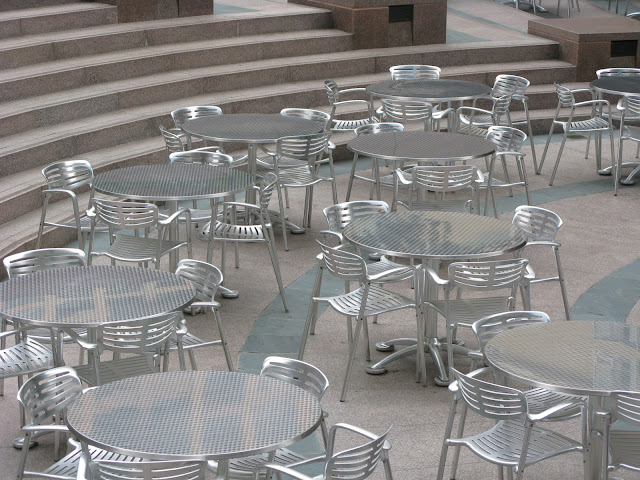
You are a GUI agent. You are given a task and a screenshot of the screen. Output one action in this format:
    pyautogui.click(x=<x>, y=<y>)
    Task: Click on the table 6 chairs
    This screenshot has height=480, width=640.
    Given the screenshot: What is the action you would take?
    pyautogui.click(x=168, y=137), pyautogui.click(x=193, y=110), pyautogui.click(x=308, y=144), pyautogui.click(x=315, y=115)